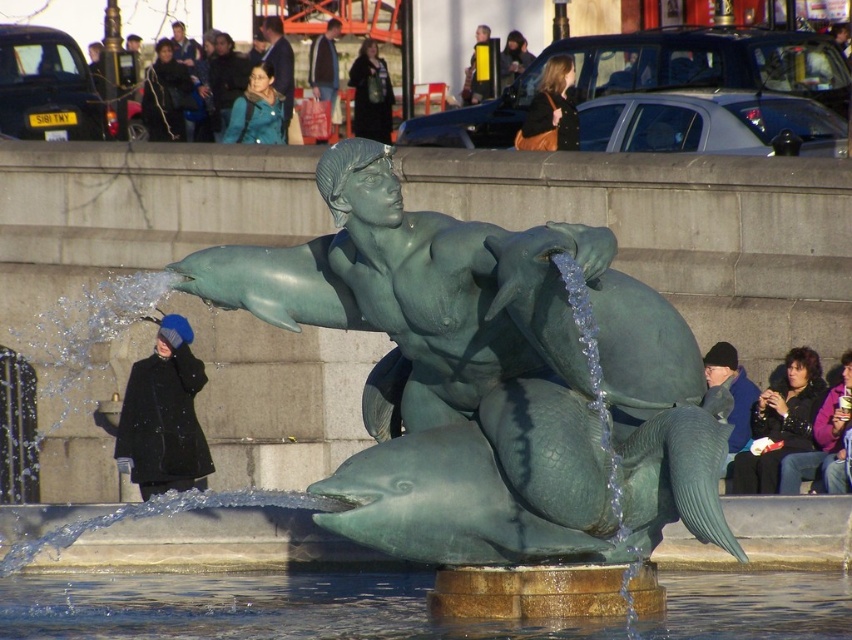
Question: Which object is positioned closest to the dark blue knit cap at upper center?

Choices:
 (A) clear water at fountain base at lower center
 (B) dark blue knit cap at upper left
 (C) dark brown leather jacket at center
 (D) black fabric jacket at lower right

Answer: (C)

Question: In this image, where is dark brown leather jacket at center located relative to matte brown jacket at center?

Choices:
 (A) above
 (B) below

Answer: (B)

Question: Does clear water at fountain base at lower center appear over black fabric jacket at lower right?

Choices:
 (A) yes
 (B) no

Answer: (B)

Question: Can you confirm if clear water at fountain base at lower center is smaller than dark blue knit cap at upper left?

Choices:
 (A) no
 (B) yes

Answer: (A)

Question: Which point is closer to the camera?

Choices:
 (A) (756, 436)
 (B) (413, 358)
 (C) (158, 52)
 (D) (205, 474)

Answer: (B)

Question: Which object appears farthest from the camera in this image?

Choices:
 (A) dark brown leather jacket at center
 (B) black fabric jacket at lower right

Answer: (A)